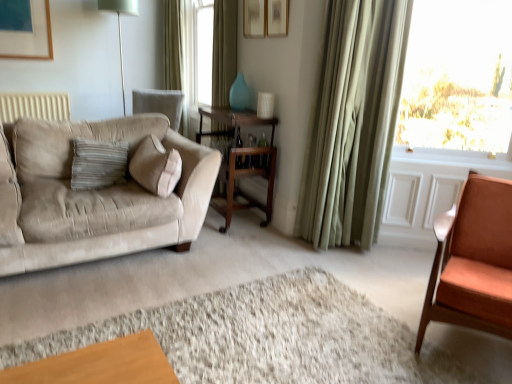
Question: Is wooden cocktail table at center to the left of green fabric curtain at upper center, acting as the first curtain starting from the back, from the viewer's perspective?

Choices:
 (A) no
 (B) yes

Answer: (A)

Question: Is wooden cocktail table at center aimed at green fabric curtain at upper center, which is counted as the 1th curtain, starting from the left?

Choices:
 (A) no
 (B) yes

Answer: (A)

Question: Is there a large distance between wooden cocktail table at center and green fabric curtain at upper center, marked as the third curtain in a right-to-left arrangement?

Choices:
 (A) yes
 (B) no

Answer: (A)

Question: Can you confirm if wooden cocktail table at center is bigger than green fabric curtain at upper center, acting as the first curtain starting from the back?

Choices:
 (A) no
 (B) yes

Answer: (B)

Question: Is wooden cocktail table at center turned away from green fabric curtain at upper center, which appears as the 3th curtain when viewed from the front?

Choices:
 (A) no
 (B) yes

Answer: (A)

Question: Is wooden cocktail table at center behind green fabric curtain at upper center, acting as the first curtain starting from the back?

Choices:
 (A) no
 (B) yes

Answer: (A)

Question: Is teal glass vase at center located outside metallic silver table lamp at upper left?

Choices:
 (A) no
 (B) yes

Answer: (B)

Question: Does teal glass vase at center appear on the right side of metallic silver table lamp at upper left?

Choices:
 (A) yes
 (B) no

Answer: (A)

Question: Is teal glass vase at center shorter than metallic silver table lamp at upper left?

Choices:
 (A) yes
 (B) no

Answer: (A)

Question: Can you confirm if teal glass vase at center is positioned to the left of metallic silver table lamp at upper left?

Choices:
 (A) no
 (B) yes

Answer: (A)

Question: From a real-world perspective, is teal glass vase at center on metallic silver table lamp at upper left?

Choices:
 (A) no
 (B) yes

Answer: (A)

Question: Considering the relative positions of teal glass vase at center and metallic silver table lamp at upper left in the image provided, is teal glass vase at center behind metallic silver table lamp at upper left?

Choices:
 (A) yes
 (B) no

Answer: (B)

Question: Is wooden cocktail table at center taller than wooden table at center?

Choices:
 (A) yes
 (B) no

Answer: (A)